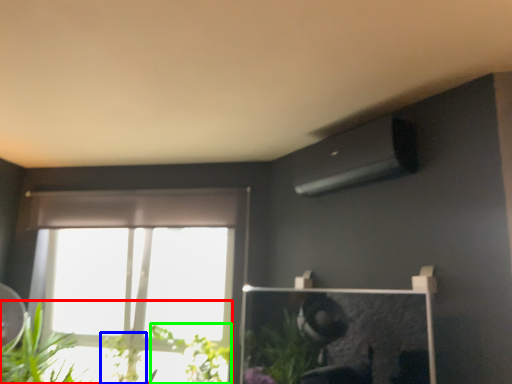
Question: Estimate the real-world distances between objects in this image. Which object is farther from houseplant (highlighted by a red box), plant (highlighted by a blue box) or plant (highlighted by a green box)?

Choices:
 (A) plant
 (B) plant

Answer: (B)